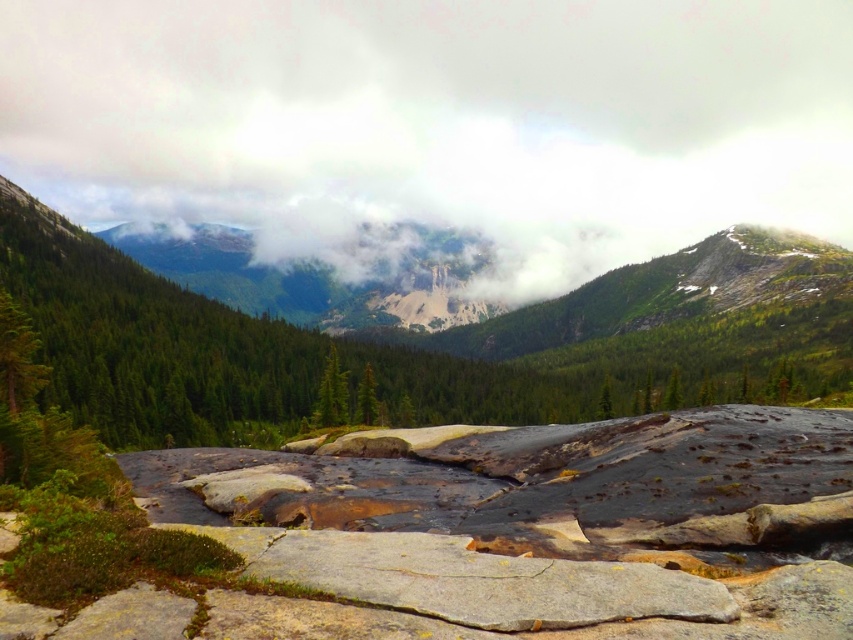
You are an environmental scientist observing this landscape. You notice the green matte tree at center and the white fluffy cloud at upper center. Which object is closer to the observer?

The white fluffy cloud at upper center is closer to the observer because the green matte tree at center is behind it.

You are an astronomer analyzing the image to determine the position of celestial objects. You need to place a star marker at the exact center of the image. Is the white fluffy cloud at upper center located above or below the star marker?

The white fluffy cloud at upper center is located at point (437,122). Since the star marker is placed at the exact center, which is typically at coordinates like (426,320) in normalized image coordinates, the cloud is below the star marker.

You are an astronomer analyzing the sky in this landscape image. You notice a point of interest at coordinates point [437,122]. What celestial object might be located there?

The white fluffy cloud at upper center is located at point [437,122], so the celestial object there is the white fluffy cloud at upper center.